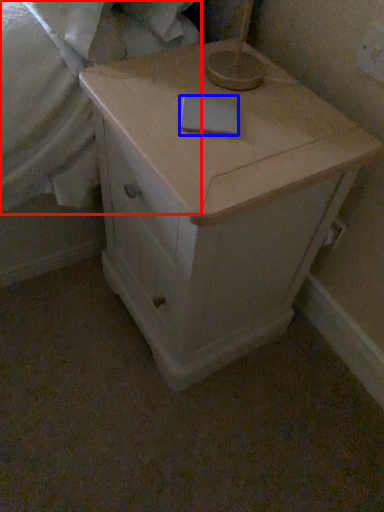
Question: Which object is closer to the camera taking this photo, sheet (highlighted by a red box) or notepad (highlighted by a blue box)?

Choices:
 (A) sheet
 (B) notepad

Answer: (A)